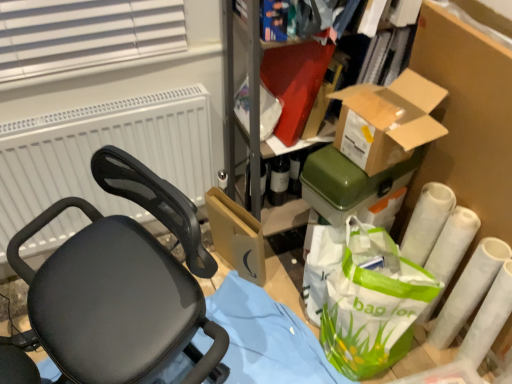
What do you see at coordinates (372, 303) in the screenshot?
I see `green plastic bag at right` at bounding box center [372, 303].

At what (x,y) coordinates should I click in order to perform the action: click on white matte toilet paper at lower right, acting as the 2th toilet paper starting from the left. Please return your answer as a coordinate pair (x, y). This screenshot has height=384, width=512. Looking at the image, I should click on (469, 290).

Locate an element on the screen. green plastic container at upper right, the second box when ordered from front to back is located at coordinates (346, 182).

I want to click on white matte radiator at upper left, so click(x=100, y=147).

Which is correct: white matte radiator at upper left is inside white matte toilet paper at lower right, the 1th toilet paper when ordered from right to left, or outside of it?

white matte radiator at upper left cannot be found inside white matte toilet paper at lower right, the 1th toilet paper when ordered from right to left.

In the image, there is a white matte toilet paper at lower right, acting as the 2th toilet paper starting from the left. Where is `radiator above it (from the image's perspective)`? The height and width of the screenshot is (384, 512). radiator above it (from the image's perspective) is located at coordinates (100, 147).

Can you tell me how much white matte radiator at upper left and white matte toilet paper at lower right, the 1th toilet paper when ordered from right to left, differ in facing direction?

The angle between the facing direction of white matte radiator at upper left and the facing direction of white matte toilet paper at lower right, the 1th toilet paper when ordered from right to left, is 172 degrees.

Considering the positions of point (98, 120) and point (468, 265), is point (98, 120) closer or farther from the camera than point (468, 265)?

Point (98, 120) appears to be farther away from the viewer than point (468, 265).

Is green plastic container at upper right, the second box when ordered from front to back, positioned far away from black mesh chair at left?

That's not correct — green plastic container at upper right, the second box when ordered from front to back, is a little close to black mesh chair at left.

Can you confirm if green plastic container at upper right, the second box when ordered from front to back, is positioned to the right of black mesh chair at left?

Indeed, green plastic container at upper right, the second box when ordered from front to back, is positioned on the right side of black mesh chair at left.

Which of these two, green plastic container at upper right, which is the 1th box from back to front, or black mesh chair at left, is wider?

With larger width is black mesh chair at left.

Between point (354, 198) and point (166, 322), which one is positioned behind?

Positioned behind is point (354, 198).

Considering the relative sizes of white matte toilet paper at lower right, acting as the 2th toilet paper starting from the right, and brown cardboard box at upper right, marked as the second box in a back-to-front arrangement, in the image provided, is white matte toilet paper at lower right, acting as the 2th toilet paper starting from the right, taller than brown cardboard box at upper right, marked as the second box in a back-to-front arrangement,?

Correct, white matte toilet paper at lower right, acting as the 2th toilet paper starting from the right, is much taller as brown cardboard box at upper right, marked as the second box in a back-to-front arrangement.

Considering the relative sizes of white matte toilet paper at lower right, which is the first toilet paper in left-to-right order, and brown cardboard box at upper right, acting as the 1th box starting from the front, in the image provided, is white matte toilet paper at lower right, which is the first toilet paper in left-to-right order, wider than brown cardboard box at upper right, acting as the 1th box starting from the front,?

In fact, white matte toilet paper at lower right, which is the first toilet paper in left-to-right order, might be narrower than brown cardboard box at upper right, acting as the 1th box starting from the front.

From the image's perspective, which object appears higher, white matte toilet paper at lower right, which is the first toilet paper in left-to-right order, or brown cardboard box at upper right, acting as the 1th box starting from the front?

brown cardboard box at upper right, acting as the 1th box starting from the front, appears higher in the image.

You are a GUI agent. You are given a task and a screenshot of the screen. Output one action in this format:
    pyautogui.click(x=<x>, y=<y>)
    Task: Click on the 1st toilet paper below the brown cardboard box at upper right, acting as the 1th box starting from the front (from the image's perspective)
    The width and height of the screenshot is (512, 384).
    Given the screenshot: What is the action you would take?
    pyautogui.click(x=439, y=231)

Does white matte radiator at upper left have a greater height compared to black mesh chair at left?

No, white matte radiator at upper left is not taller than black mesh chair at left.

Is point (189, 134) closer or farther from the camera than point (77, 287)?

Point (189, 134) appears to be farther away from the viewer than point (77, 287).

From the picture: Does white matte radiator at upper left contain black mesh chair at left?

No, black mesh chair at left is not inside white matte radiator at upper left.

From a real-world perspective, is white matte radiator at upper left located higher than green plastic bag at right?

Yes.

Consider the image. Would you consider white matte radiator at upper left to be distant from green plastic bag at right?

No, white matte radiator at upper left is not far from green plastic bag at right.

Considering the positions of objects white matte radiator at upper left and green plastic bag at right in the image provided, who is more to the right, white matte radiator at upper left or green plastic bag at right?

green plastic bag at right is more to the right.

Considering the sizes of objects white matte radiator at upper left and green plastic bag at right in the image provided, who is shorter, white matte radiator at upper left or green plastic bag at right?

white matte radiator at upper left is shorter.

Is brown cardboard box at upper right, acting as the 1th box starting from the front, positioned with its back to white matte radiator at upper left?

That's not correct — brown cardboard box at upper right, acting as the 1th box starting from the front, is not looking away from white matte radiator at upper left.

This screenshot has height=384, width=512. In order to click on the 2nd box positioned above the white matte radiator at upper left (from a real-world perspective) in this screenshot , I will do `click(388, 120)`.

From the image's perspective, relative to white matte radiator at upper left, is brown cardboard box at upper right, marked as the second box in a back-to-front arrangement, above or below?

From the image's perspective, brown cardboard box at upper right, marked as the second box in a back-to-front arrangement, appears above white matte radiator at upper left.

In the scene shown: Is brown cardboard box at upper right, marked as the second box in a back-to-front arrangement, not close to white matte radiator at upper left?

No, brown cardboard box at upper right, marked as the second box in a back-to-front arrangement, is not far away from white matte radiator at upper left.

From the image's perspective, relative to white matte radiator at upper left, is black mesh chair at left above or below?

Based on their image positions, black mesh chair at left is located beneath white matte radiator at upper left.

Locate an element on the screen. Image resolution: width=512 pixels, height=384 pixels. radiator above the black mesh chair at left (from a real-world perspective) is located at coordinates (100, 147).

Visually, is black mesh chair at left positioned to the left or to the right of white matte radiator at upper left?

black mesh chair at left is to the right of white matte radiator at upper left.

In order to click on radiator on the left of white matte toilet paper at lower right, acting as the 2th toilet paper starting from the left in this screenshot , I will do `click(100, 147)`.

There is a black mesh chair at left. Where is `the 1st box above it (from the image's perspective)`? The width and height of the screenshot is (512, 384). the 1st box above it (from the image's perspective) is located at coordinates (346, 182).

Which object lies nearer to the anchor point brown cardboard box at upper right, marked as the second box in a back-to-front arrangement, green plastic bag at right or white matte radiator at upper left?

green plastic bag at right lies closer to brown cardboard box at upper right, marked as the second box in a back-to-front arrangement, than the other object.

Estimate the real-world distances between objects in this image. Which object is closer to green plastic bag at right, white matte toilet paper at lower right, acting as the 2th toilet paper starting from the right, or white matte toilet paper at lower right, acting as the 2th toilet paper starting from the left?

Among the two, white matte toilet paper at lower right, acting as the 2th toilet paper starting from the right, is located nearer to green plastic bag at right.

Which object lies nearer to the anchor point green plastic bag at right, brown cardboard box at upper right, marked as the second box in a back-to-front arrangement, or green plastic container at upper right, which is the 1th box from back to front?

green plastic container at upper right, which is the 1th box from back to front, is positioned closer to the anchor green plastic bag at right.

When comparing their distances from brown cardboard box at upper right, marked as the second box in a back-to-front arrangement, does black mesh chair at left or green plastic bag at right seem further?

black mesh chair at left is further to brown cardboard box at upper right, marked as the second box in a back-to-front arrangement.

Considering their positions, is black mesh chair at left positioned further to brown cardboard box at upper right, acting as the 1th box starting from the front, than white matte toilet paper at lower right, acting as the 2th toilet paper starting from the left?

black mesh chair at left lies further to brown cardboard box at upper right, acting as the 1th box starting from the front, than the other object.

When comparing their distances from white matte toilet paper at lower right, which is the first toilet paper in left-to-right order, does white matte radiator at upper left or brown cardboard box at upper right, marked as the second box in a back-to-front arrangement, seem further?

Among the two, white matte radiator at upper left is located further to white matte toilet paper at lower right, which is the first toilet paper in left-to-right order.

Considering their positions, is green plastic container at upper right, the second box when ordered from front to back, positioned further to white matte toilet paper at lower right, which is the first toilet paper in left-to-right order, than green plastic bag at right?

green plastic container at upper right, the second box when ordered from front to back, is further to white matte toilet paper at lower right, which is the first toilet paper in left-to-right order.

From the image, which object appears to be nearer to white matte radiator at upper left, green plastic container at upper right, the second box when ordered from front to back, or green plastic bag at right?

The object closer to white matte radiator at upper left is green plastic container at upper right, the second box when ordered from front to back.

Locate an element on the screen. The width and height of the screenshot is (512, 384). toilet paper between brown cardboard box at upper right, marked as the second box in a back-to-front arrangement, and white matte toilet paper at lower right, the 1th toilet paper when ordered from right to left, from top to bottom is located at coordinates (439, 231).

You are a GUI agent. You are given a task and a screenshot of the screen. Output one action in this format:
    pyautogui.click(x=<x>, y=<y>)
    Task: Click on the box between brown cardboard box at upper right, marked as the second box in a back-to-front arrangement, and white matte toilet paper at lower right, acting as the 2th toilet paper starting from the left, vertically
    
    Given the screenshot: What is the action you would take?
    pyautogui.click(x=346, y=182)

Image resolution: width=512 pixels, height=384 pixels. I want to click on box between white matte radiator at upper left and brown cardboard box at upper right, acting as the 1th box starting from the front, in the horizontal direction, so coord(346,182).

You are a GUI agent. You are given a task and a screenshot of the screen. Output one action in this format:
    pyautogui.click(x=<x>, y=<y>)
    Task: Click on the toilet paper between green plastic bag at right and white matte toilet paper at lower right, the 1th toilet paper when ordered from right to left, from left to right
    
    Given the screenshot: What is the action you would take?
    pyautogui.click(x=439, y=231)